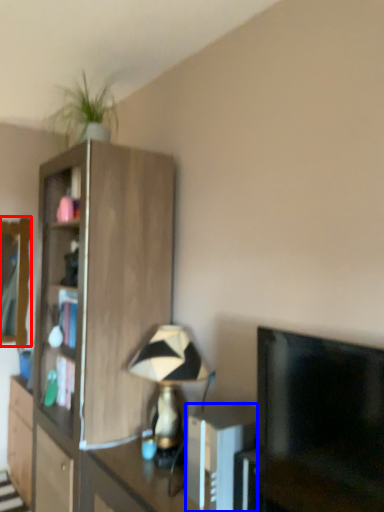
Question: Which point is closer to the camera, mirror (highlighted by a red box) or appliance (highlighted by a blue box)?

Choices:
 (A) mirror
 (B) appliance

Answer: (B)